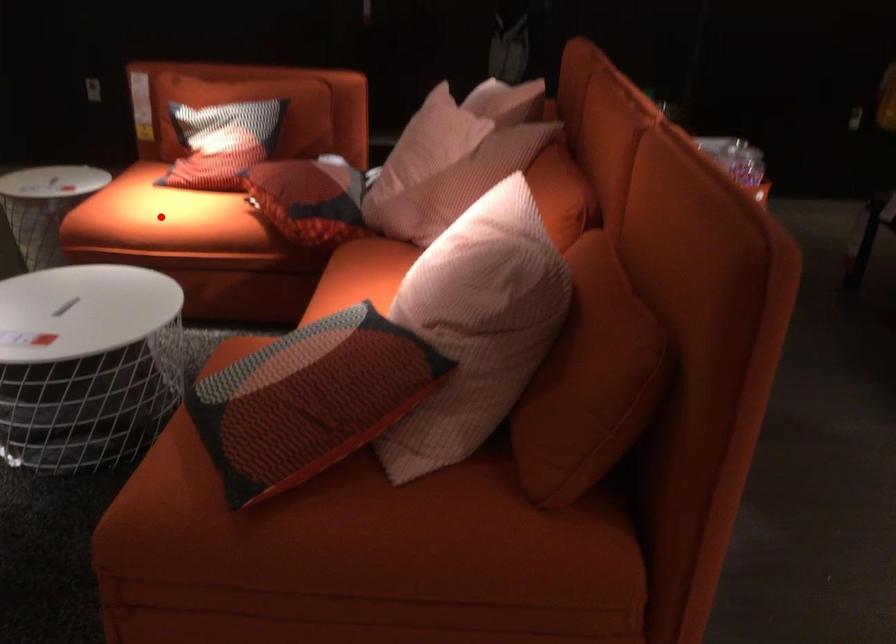
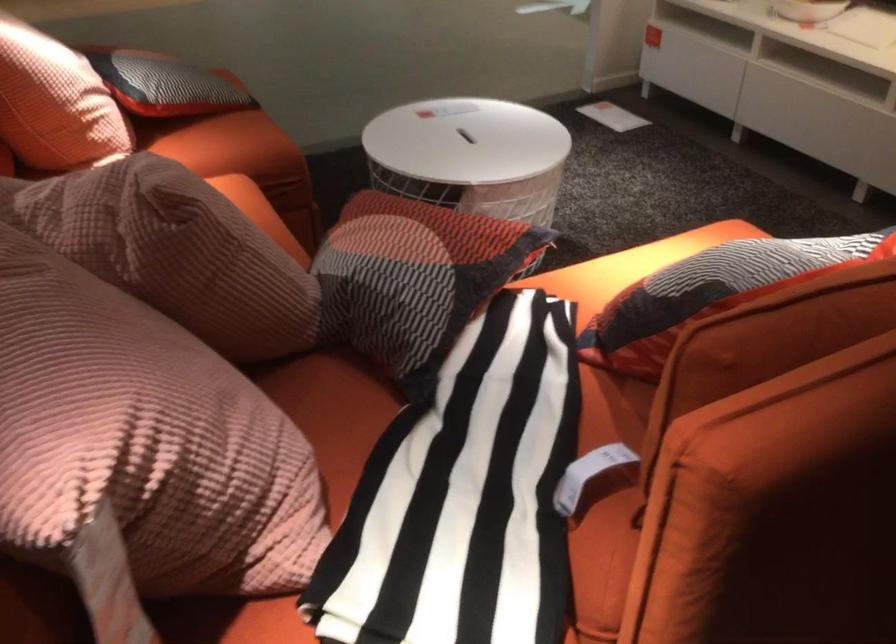
Question: I am providing you with two images of the same scene from different viewpoints. A red point is marked on the first image. Can you still see the location of the red point in image 2?

Choices:
 (A) Yes
 (B) No

Answer: (B)